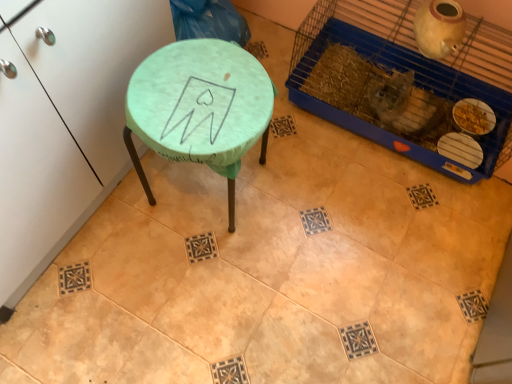
Question: From the image's perspective, is green fabric-covered stool at upper left on matte green stool at center?

Choices:
 (A) no
 (B) yes

Answer: (B)

Question: Can you confirm if green fabric-covered stool at upper left is shorter than matte green stool at center?

Choices:
 (A) yes
 (B) no

Answer: (B)

Question: Would you say green fabric-covered stool at upper left is a long distance from matte green stool at center?

Choices:
 (A) no
 (B) yes

Answer: (A)

Question: Is the depth of green fabric-covered stool at upper left less than that of matte green stool at center?

Choices:
 (A) yes
 (B) no

Answer: (A)

Question: Is green fabric-covered stool at upper left not within matte green stool at center?

Choices:
 (A) yes
 (B) no

Answer: (A)

Question: Does green fabric-covered stool at upper left appear on the right side of matte green stool at center?

Choices:
 (A) yes
 (B) no

Answer: (B)

Question: From the image's perspective, does blue plastic bird cage at upper right appear lower than green fabric-covered stool at upper left?

Choices:
 (A) yes
 (B) no

Answer: (B)

Question: Is blue plastic bird cage at upper right smaller than green fabric-covered stool at upper left?

Choices:
 (A) no
 (B) yes

Answer: (B)

Question: Is blue plastic bird cage at upper right looking in the opposite direction of green fabric-covered stool at upper left?

Choices:
 (A) no
 (B) yes

Answer: (A)

Question: From a real-world perspective, is blue plastic bird cage at upper right beneath green fabric-covered stool at upper left?

Choices:
 (A) yes
 (B) no

Answer: (A)

Question: Considering the relative positions of blue plastic bird cage at upper right and green fabric-covered stool at upper left in the image provided, is blue plastic bird cage at upper right behind green fabric-covered stool at upper left?

Choices:
 (A) no
 (B) yes

Answer: (B)

Question: Does blue plastic bird cage at upper right appear on the right side of green fabric-covered stool at upper left?

Choices:
 (A) no
 (B) yes

Answer: (B)

Question: Considering the relative sizes of green fabric-covered stool at upper left and blue plastic bird cage at upper right in the image provided, is green fabric-covered stool at upper left shorter than blue plastic bird cage at upper right?

Choices:
 (A) no
 (B) yes

Answer: (A)